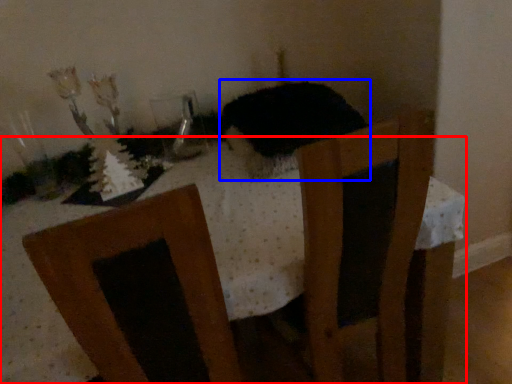
Question: Which object appears closest to the camera in this image, table (highlighted by a red box) or animal (highlighted by a blue box)?

Choices:
 (A) table
 (B) animal

Answer: (A)